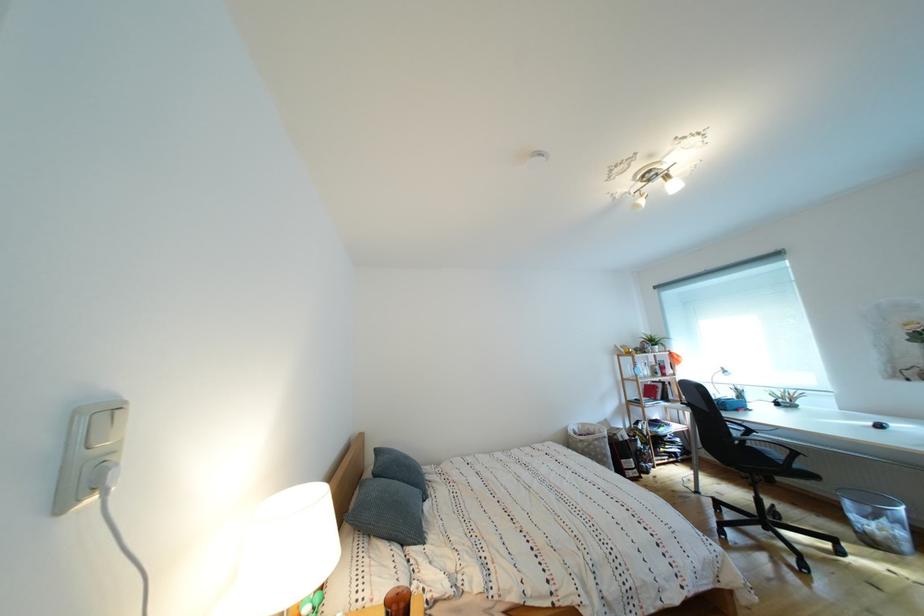
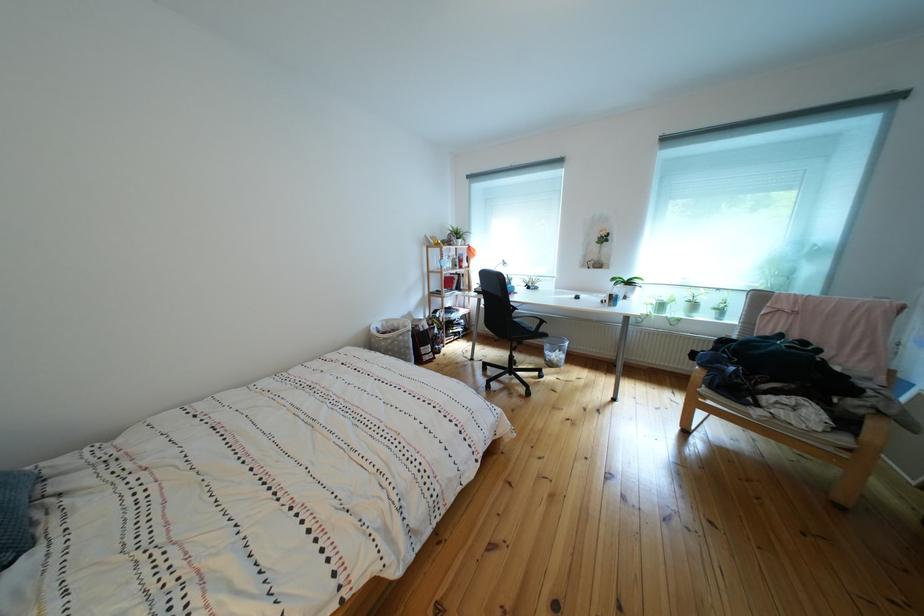
First-person continuous shooting, in which direction is the camera rotating?

The camera rotated toward right-down.